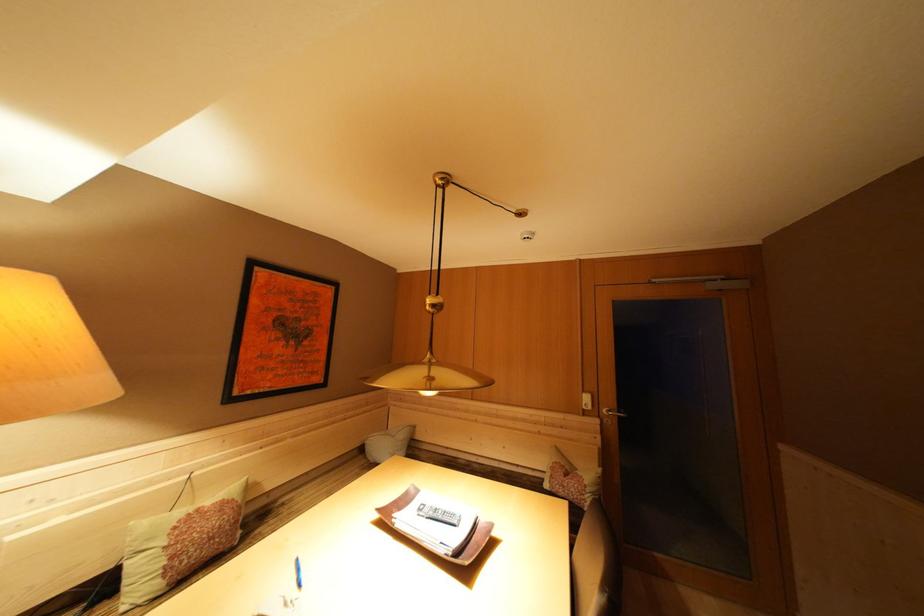
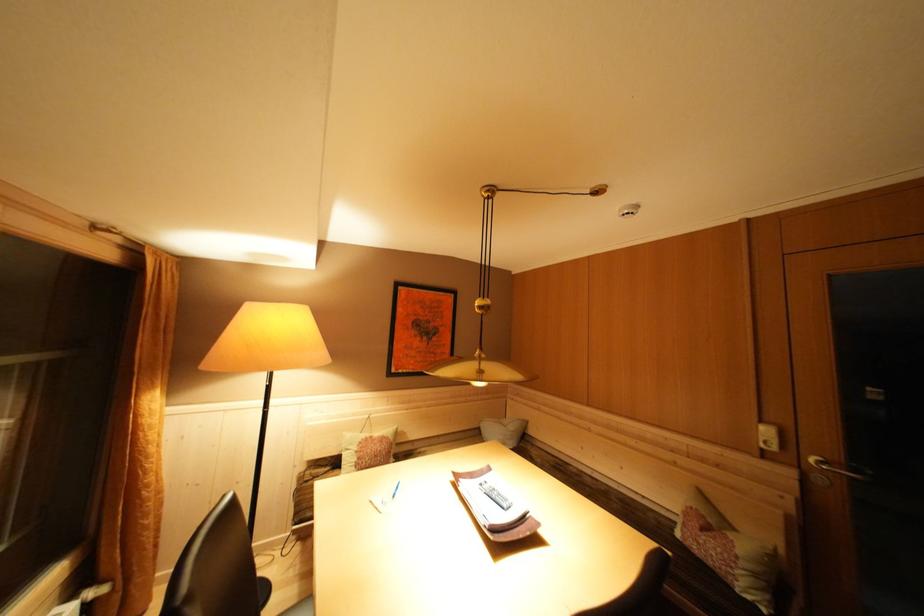
Question: I am providing you with two images of the same scene from different viewpoints. Which of the following objects are not visible in image2?

Choices:
 (A) metal door handle
 (B) white cushion
 (C) white power outlet
 (D) none of these

Answer: (D)